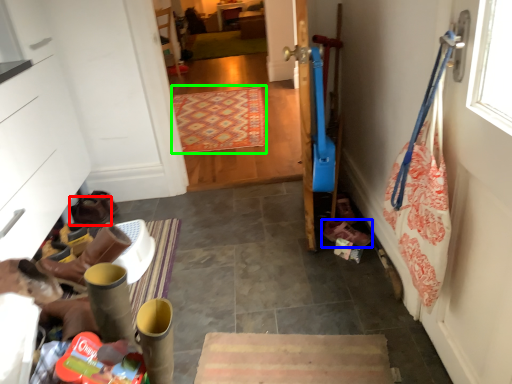
Question: Which is nearer to the footwear (highlighted by a red box)? footwear (highlighted by a blue box) or mat (highlighted by a green box).

Choices:
 (A) footwear
 (B) mat

Answer: (A)